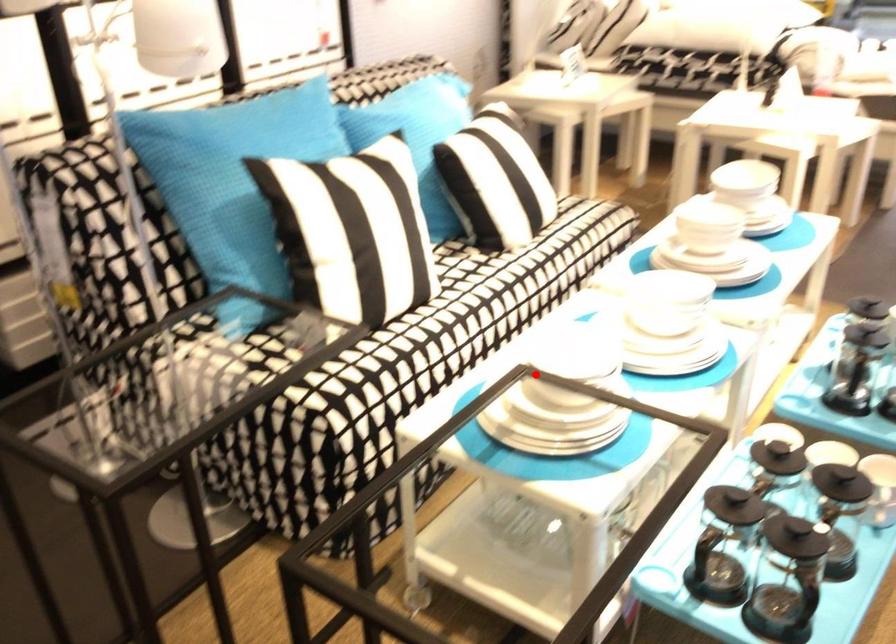
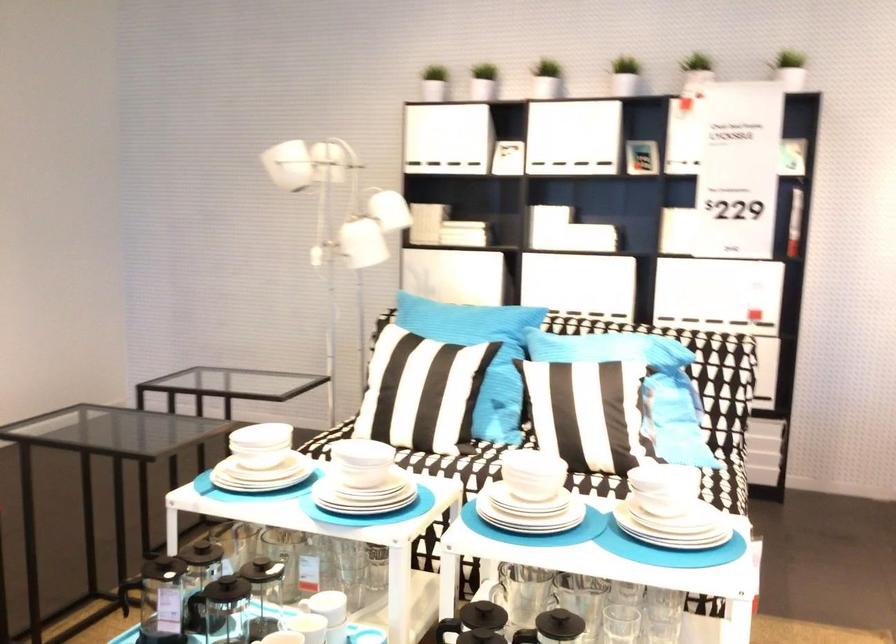
Question: I am providing you with two images of the same scene from different viewpoints. Image1 has a red point marked. In image2, the corresponding 3D location appears at what relative position? Reply with the corresponding letter.

Choices:
 (A) Closer
 (B) Farther

Answer: (B)